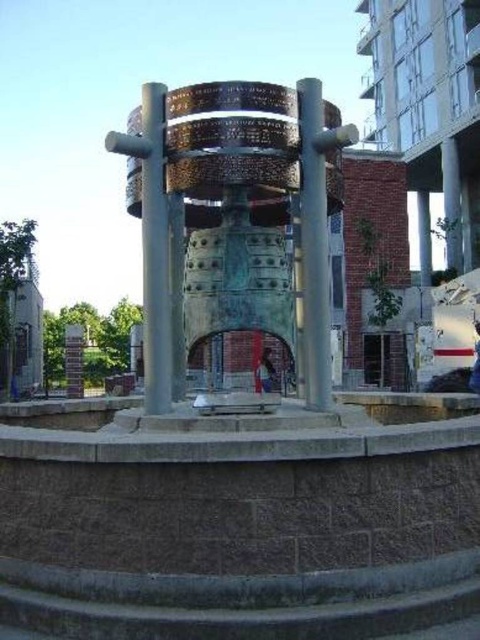
Is point (204, 186) in front of point (300, 150)?

No, it is behind (300, 150).

Does bronze textured bell at center have a greater height compared to metallic polished pole at center?

Indeed, bronze textured bell at center has a greater height compared to metallic polished pole at center.

Find the location of a particular element. The width and height of the screenshot is (480, 640). bronze textured bell at center is located at coordinates (235, 220).

Does point (301, 128) lie behind point (153, 280)?

Yes.

The height and width of the screenshot is (640, 480). I want to click on metallic polished pole at center, so click(313, 244).

Who is shorter, bronze textured bell at center or polished bronze pillar at center?

bronze textured bell at center

Does bronze textured bell at center appear under polished bronze pillar at center?

Incorrect, bronze textured bell at center is not positioned below polished bronze pillar at center.

Is point (190, 250) closer to camera compared to point (151, 364)?

No, (190, 250) is behind (151, 364).

Find the location of a particular element. Image resolution: width=480 pixels, height=640 pixels. bronze textured bell at center is located at coordinates (235, 220).